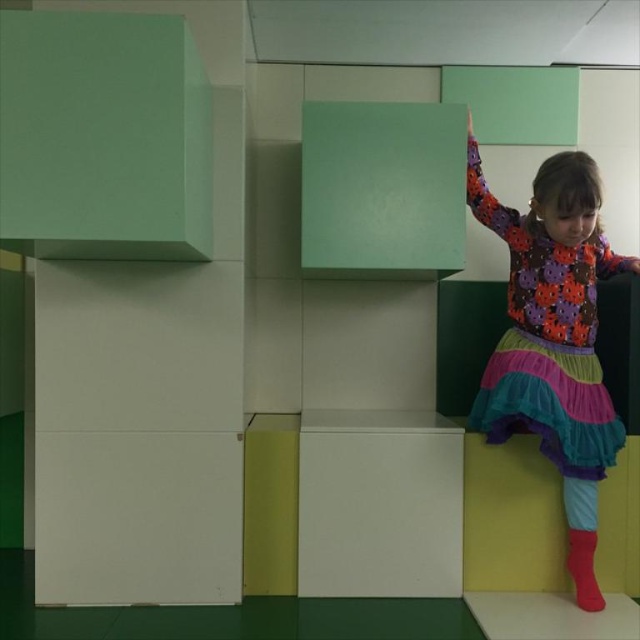
Question: Can you confirm if multicolored fabric dress at right is positioned to the left of red matte sock at lower right?

Choices:
 (A) no
 (B) yes

Answer: (B)

Question: Can you confirm if multicolored fabric dress at right is bigger than red matte sock at lower right?

Choices:
 (A) no
 (B) yes

Answer: (B)

Question: Can you confirm if multicolored fabric dress at right is positioned above red matte sock at lower right?

Choices:
 (A) yes
 (B) no

Answer: (A)

Question: Among these points, which one is nearest to the camera?

Choices:
 (A) (588, 340)
 (B) (588, 564)

Answer: (B)

Question: Among these objects, which one is farthest from the camera?

Choices:
 (A) red matte sock at lower right
 (B) multicolored fabric dress at right

Answer: (A)

Question: Which point is closer to the camera taking this photo?

Choices:
 (A) (540, 200)
 (B) (582, 548)

Answer: (A)